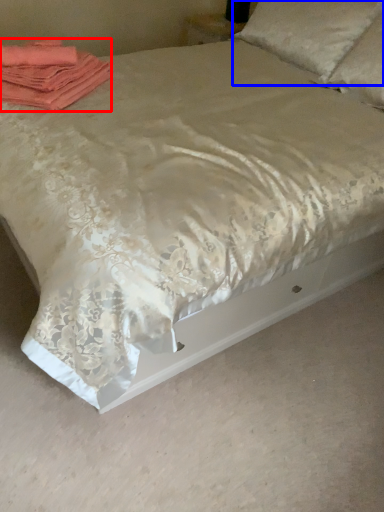
Question: Which of the following is the farthest to the observer, material (highlighted by a red box) or pillow (highlighted by a blue box)?

Choices:
 (A) material
 (B) pillow

Answer: (B)